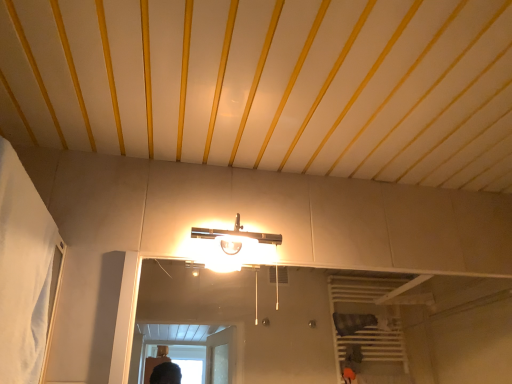
Question: Is satin nickel fixture at center inside the boundaries of white fabric curtain at left, or outside?

Choices:
 (A) inside
 (B) outside

Answer: (B)

Question: In the image, is satin nickel fixture at center on the left side or the right side of white fabric curtain at left?

Choices:
 (A) right
 (B) left

Answer: (A)

Question: From the image's perspective, relative to white fabric curtain at left, is satin nickel fixture at center above or below?

Choices:
 (A) below
 (B) above

Answer: (A)

Question: Considering the positions of white fabric curtain at left and satin nickel fixture at center in the image, is white fabric curtain at left wider or thinner than satin nickel fixture at center?

Choices:
 (A) thin
 (B) wide

Answer: (A)

Question: Looking at the image, does white fabric curtain at left seem bigger or smaller compared to satin nickel fixture at center?

Choices:
 (A) small
 (B) big

Answer: (B)

Question: From the image's perspective, relative to satin nickel fixture at center, is white fabric curtain at left above or below?

Choices:
 (A) below
 (B) above

Answer: (B)

Question: Based on their positions, is white fabric curtain at left located to the left or right of satin nickel fixture at center?

Choices:
 (A) left
 (B) right

Answer: (A)